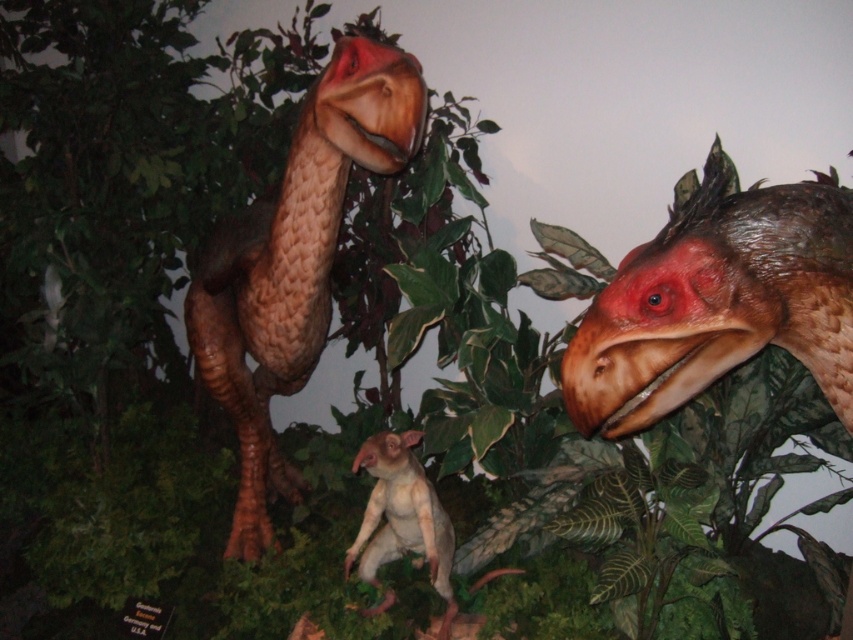
You are a paleontologist examining the diorama and need to determine which animal is bigger between the brown textured dinosaur at center and the smooth beige animal at center. Based on the scene, which one is larger?

The brown textured dinosaur at center is larger in size than the smooth beige animal at center.

Based on the photo, you are a visitor at a museum and see the diorama. You notice the brown textured dinosaur head at upper right and the brown textured dinosaur at center. Which one is located higher up in the scene?

The brown textured dinosaur head at upper right is positioned under the brown textured dinosaur at center, so the brown textured dinosaur at center is higher up in the scene.